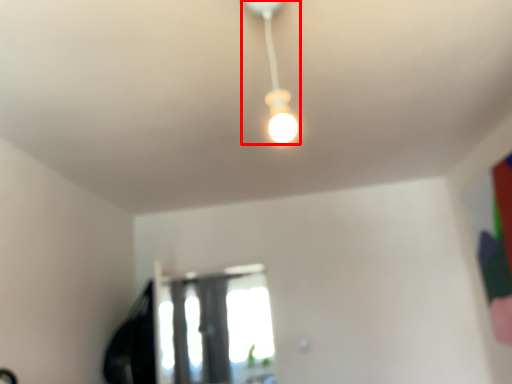
Question: In this image, where is lamp (annotated by the red box) located relative to window?

Choices:
 (A) right
 (B) left

Answer: (A)